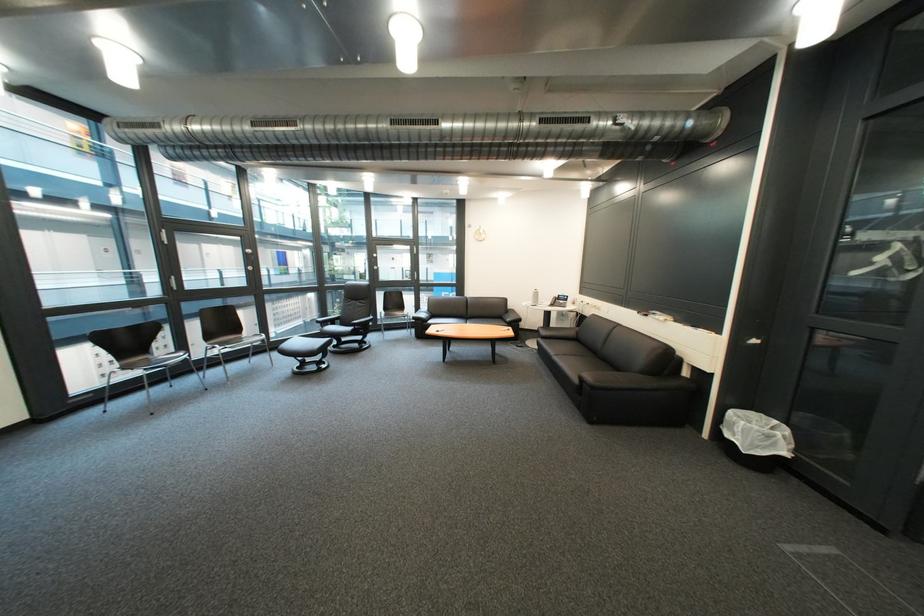
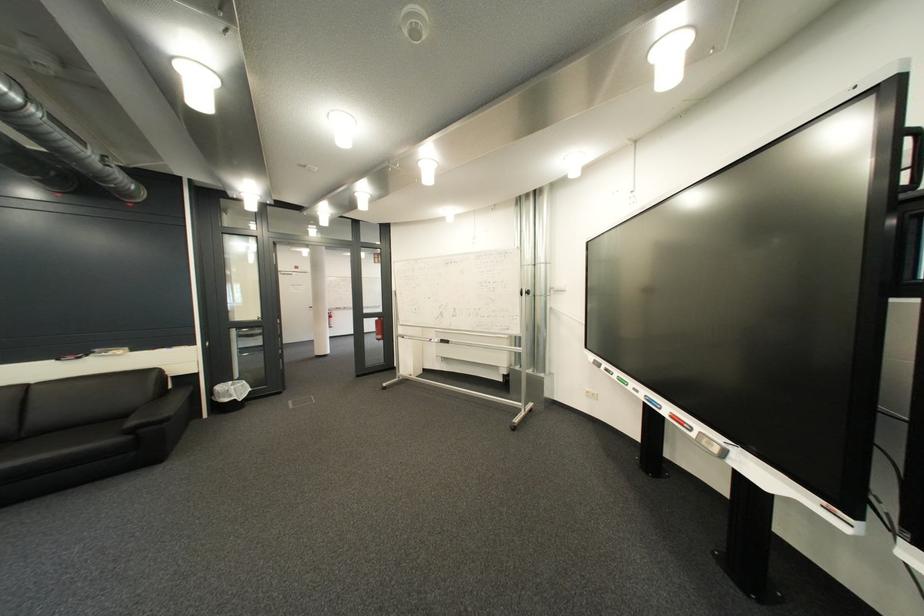
In the second image, find the point that corresponds to (x=613, y=359) in the first image.

(35, 440)